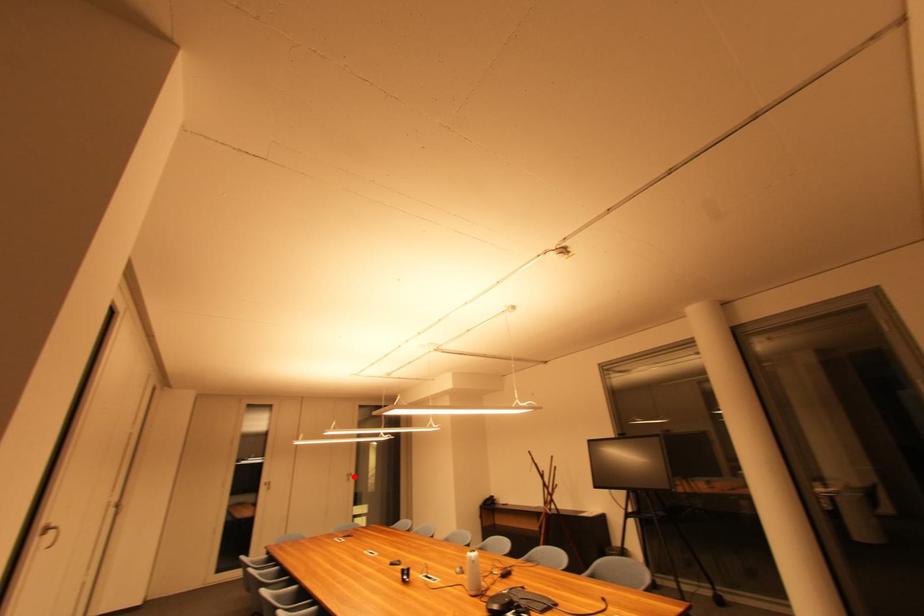
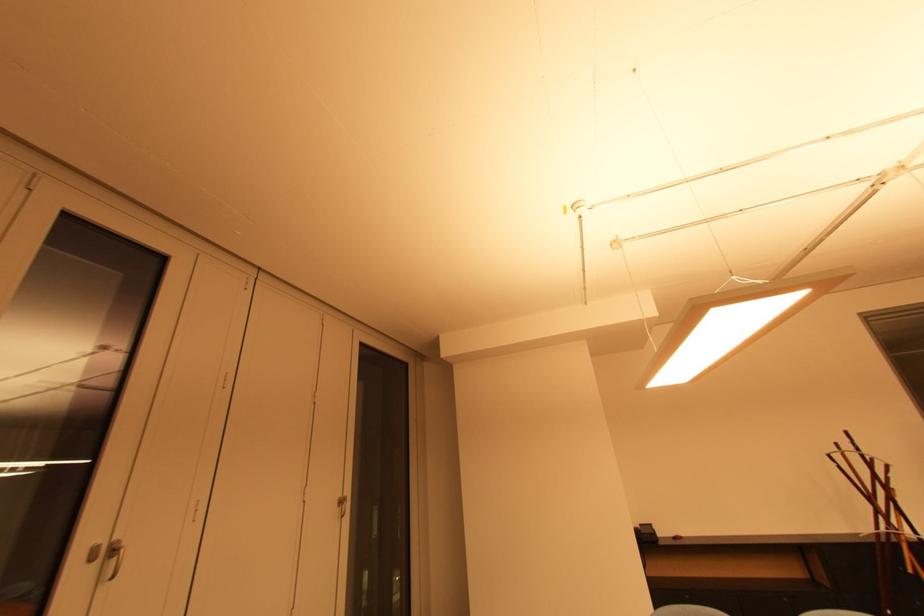
Question: A red point is marked in image1. In image2, is the corresponding 3D point closer to the camera or farther? Reply with the corresponding letter.

Choices:
 (A) The corresponding 3D point is closer.
 (B) The corresponding 3D point is farther.

Answer: (A)